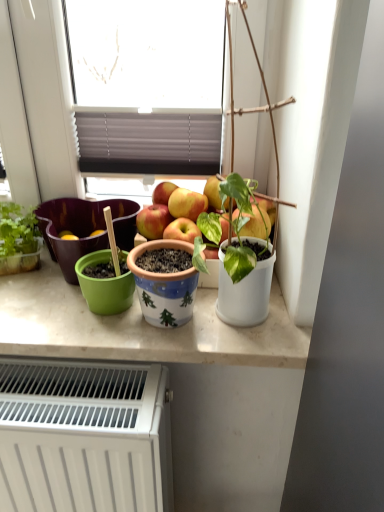
Image resolution: width=384 pixels, height=512 pixels. In order to click on vacant area in front of white matte pot at right in this screenshot , I will do `click(245, 345)`.